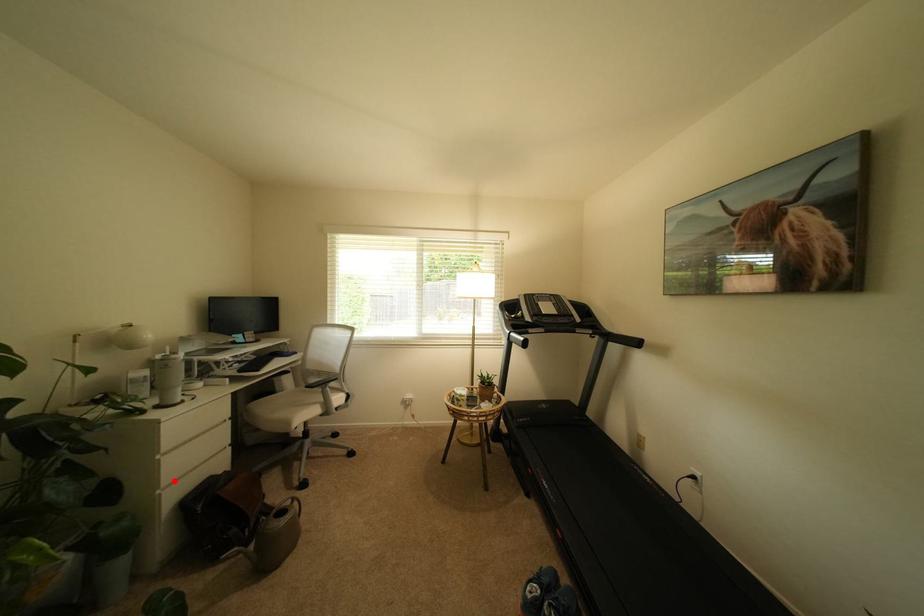
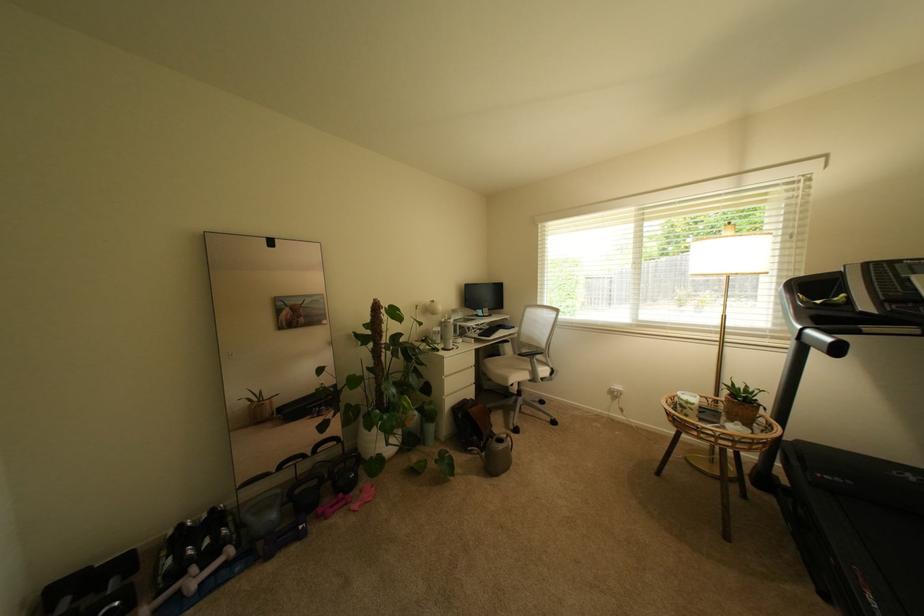
The point at the highlighted location is marked in the first image. Where is the corresponding point in the second image?

(455, 392)